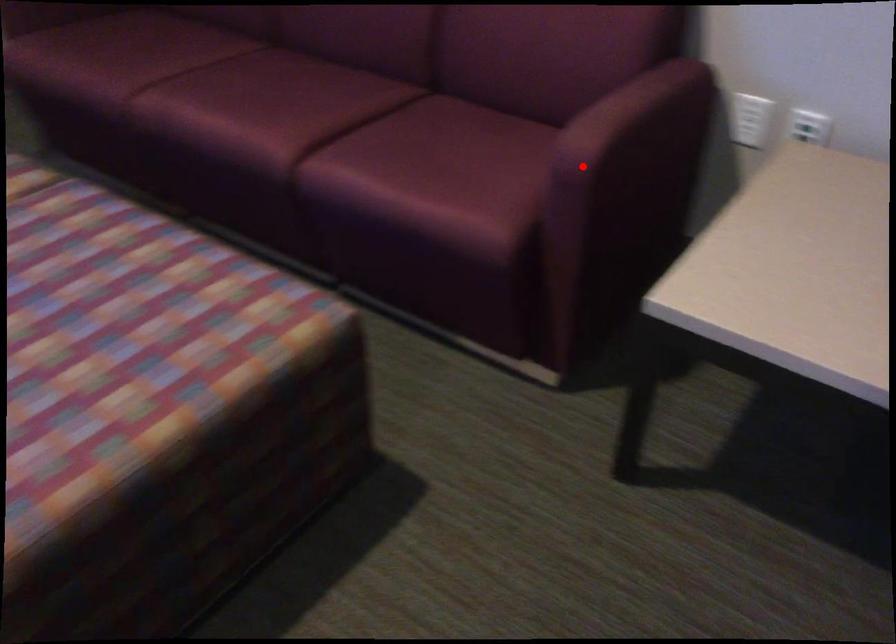
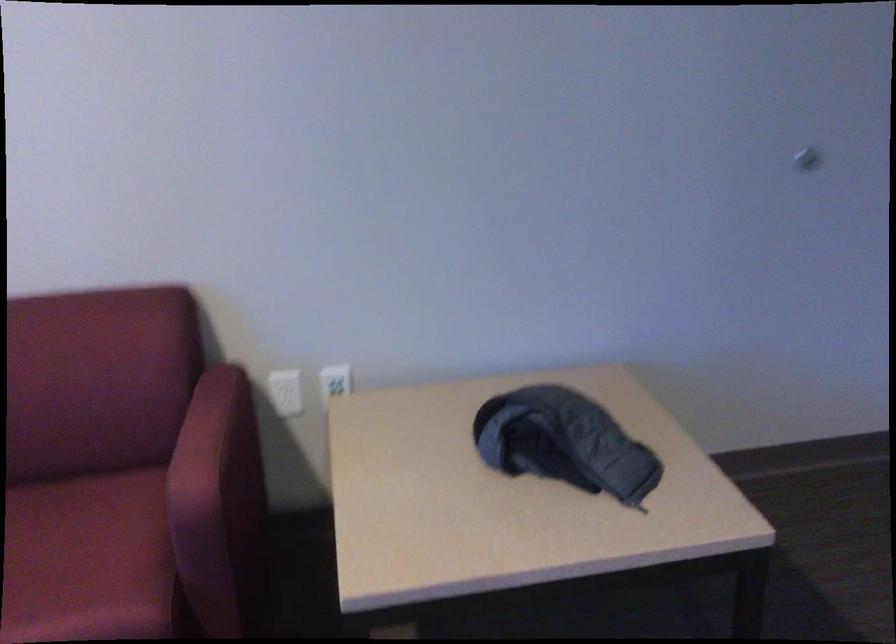
Locate, in the second image, the point that corresponds to the highlighted location in the first image.

(204, 504)